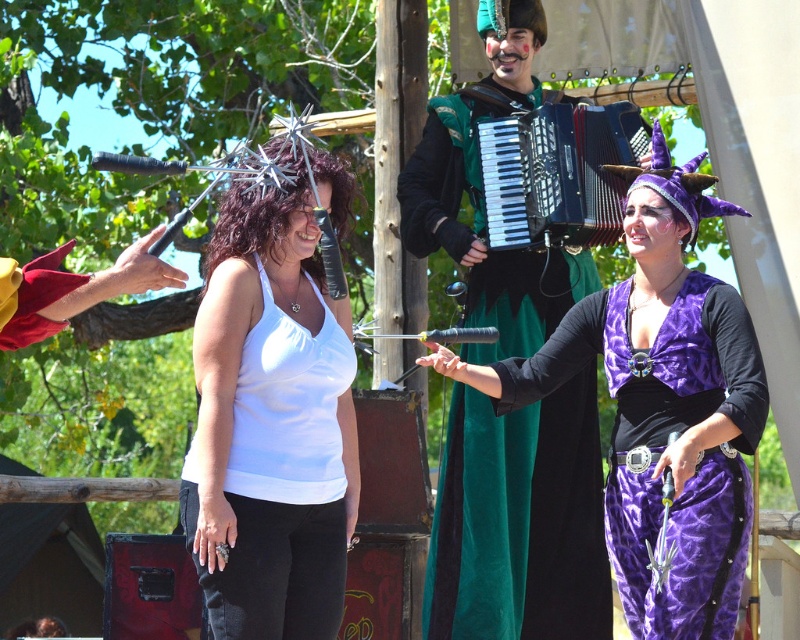
Question: Is black plastic accordion at center positioned at the back of maroon velvet glove at left?

Choices:
 (A) yes
 (B) no

Answer: (A)

Question: Which of the following is the farthest from the observer?

Choices:
 (A) (462, 112)
 (B) (326, 176)

Answer: (A)

Question: Which point is closer to the camera taking this photo?

Choices:
 (A) click(x=332, y=513)
 (B) click(x=694, y=611)

Answer: (A)

Question: Which is nearer to the white matte tank top at center?

Choices:
 (A) black plastic accordion at center
 (B) purple velvet dress at center
 (C) maroon velvet glove at left
 (D) velvet green accordion at center

Answer: (B)

Question: Can you confirm if white matte tank top at center is positioned to the right of maroon velvet glove at left?

Choices:
 (A) no
 (B) yes

Answer: (B)

Question: Does velvet green accordion at center appear over black plastic accordion at center?

Choices:
 (A) no
 (B) yes

Answer: (A)